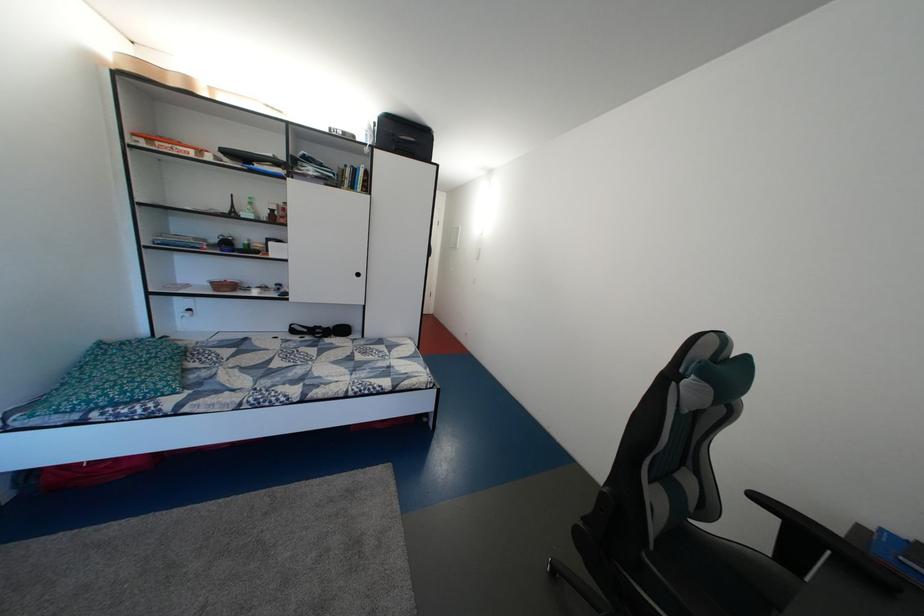
At what (x,y) coordinates should I click in order to perform the action: click on black cabinet handle. Please return your answer as a coordinate pair (x, y). The height and width of the screenshot is (616, 924). Looking at the image, I should click on (357, 278).